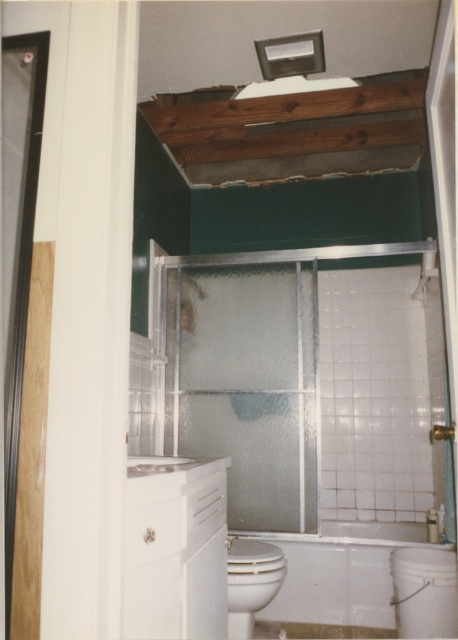
You are a contractor measuring the bathroom for new fixtures. You need to install a new light fixture at point [201,428]. The safety guidelines require that the fixture must be at least 7 feet away from the camera position. Is the distance sufficient?

The distance between point [201,428] and the camera is 10.25 feet, which exceeds the required 7 feet. Therefore, the distance is sufficient for installation according to safety guidelines.

You are standing in the bathroom and want to move from the frosted glass shower door at center to the white glossy toilet bowl at lower center. In which direction should you move?

You should move to the right because the frosted glass shower door at center is to the left of the white glossy toilet bowl at lower center.

Consider the image. You are a contractor assessing the bathroom renovation. The frosted glass shower door at center is positioned at coordinates 0.603, 0.539. If the exposed ceiling area is at coordinates 0.4, 0.3, is the shower door closer to the exposed ceiling area or the vanity cabinet?

The frosted glass shower door at center is located at point (x=246, y=385). The exposed ceiling area is at (x=137, y=256), and the vanity cabinet is in the foreground. Since the shower door is closer to the exposed ceiling area in terms of coordinates, it is nearer to the exposed ceiling area than the vanity cabinet.